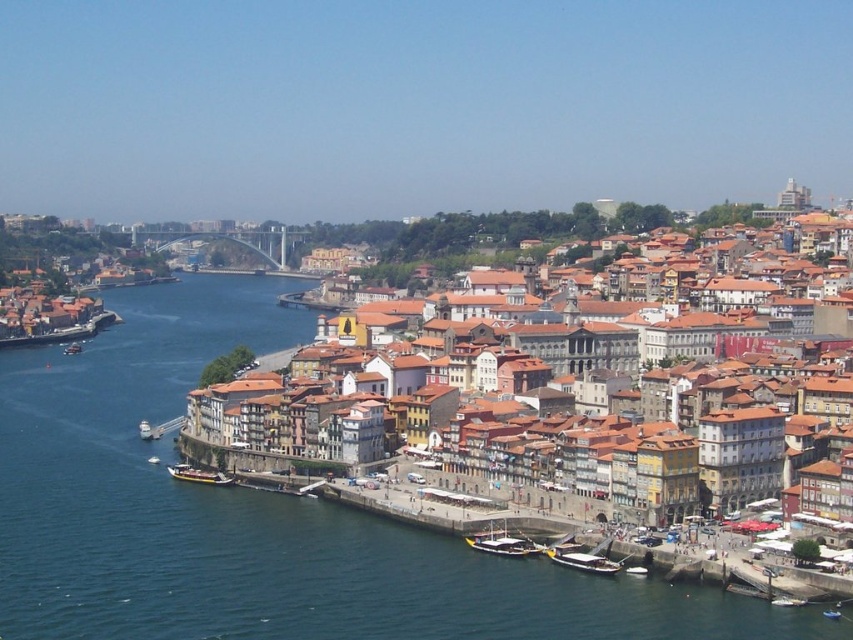
Question: Is brown textured buildings at center further to camera compared to metallic silver boat at lower right?

Choices:
 (A) no
 (B) yes

Answer: (B)

Question: Which of the following is the farthest from the observer?

Choices:
 (A) brown textured buildings at center
 (B) white matte boat at lower right
 (C) wooden polished boat at lower left
 (D) white plastic boat at center

Answer: (C)

Question: Is metallic silver boat at lower right below wooden boat at lower left?

Choices:
 (A) no
 (B) yes

Answer: (B)

Question: Does wooden polished boat at lower center have a greater width compared to wooden polished boat at lower left?

Choices:
 (A) yes
 (B) no

Answer: (B)

Question: Which point appears farthest from the camera in this image?

Choices:
 (A) (785, 596)
 (B) (596, 561)

Answer: (B)

Question: Which object is the closest to the brown textured buildings at center?

Choices:
 (A) white plastic boat at center
 (B) wooden polished boat at lower center

Answer: (B)